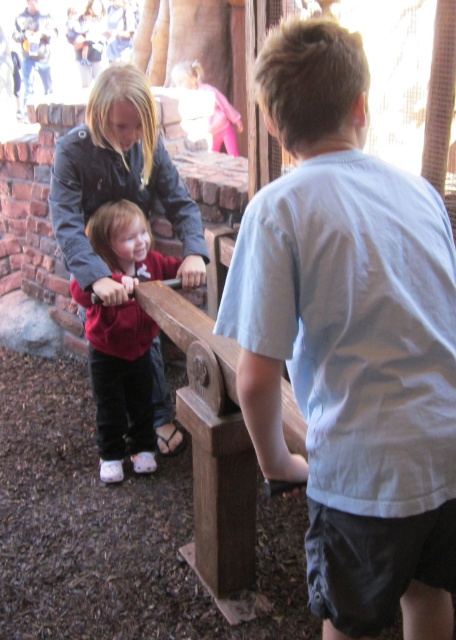
Question: Can you confirm if wooden park bench at center is positioned below matte red shirt at center?

Choices:
 (A) yes
 (B) no

Answer: (A)

Question: Is white cotton shirt at center below wooden park bench at center?

Choices:
 (A) no
 (B) yes

Answer: (A)

Question: Which of the following is the closest to the observer?

Choices:
 (A) click(103, 387)
 (B) click(340, 68)
 (C) click(188, 417)

Answer: (B)

Question: Which of the following is the closest to the observer?

Choices:
 (A) wooden park bench at center
 (B) white cotton shirt at center
 (C) matte red shirt at center

Answer: (B)

Question: In this image, where is white cotton shirt at center located relative to wooden park bench at center?

Choices:
 (A) left
 (B) right

Answer: (B)

Question: Which point is farther to the camera?

Choices:
 (A) wooden park bench at center
 (B) white cotton shirt at center
 (C) matte red shirt at center

Answer: (C)